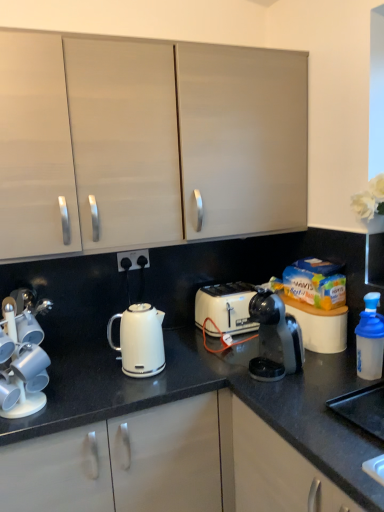
Identify the location of empty space that is ontop of white plastic toaster at center (from a real-world perspective). The height and width of the screenshot is (512, 384). (219, 289).